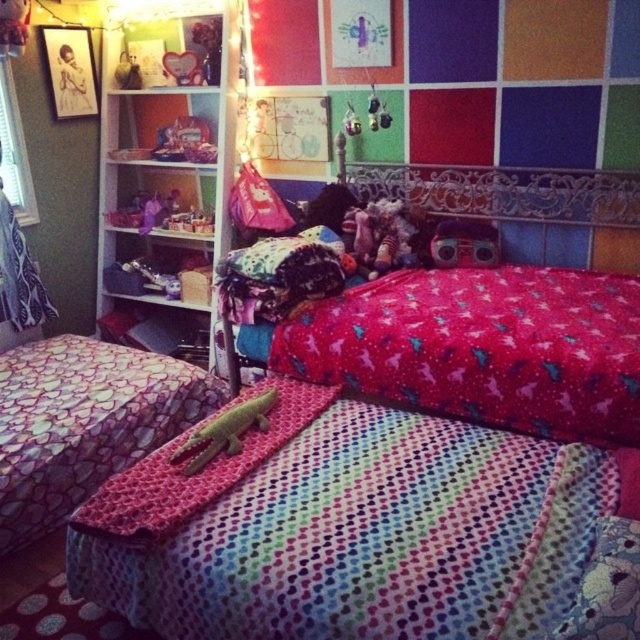
You are a parent trying to place a new nightstand in the bedroom. The nightstand is 1.2 meters tall. You see the red fabric bed at center and the matte plastic toy at center. Which object is taller and can the nightstand fit between them vertically?

The red fabric bed at center is much taller than the matte plastic toy at center. Since the nightstand is 1.2 meters tall, it can fit between them vertically as long as the space between their heights allows, but the exact placement depends on their specific height difference.

You are organizing a treasure hunt in the bedroom. The first clue is hidden on the red fabric bed at center, and the next clue is under the matte plastic toy at center. To reach the second clue from the first, which direction should you move?

To move from the red fabric bed at center to the matte plastic toy at center, you should move to the right since the red fabric bed at center is located to the left of the matte plastic toy at center.

You are standing in the bedroom and notice two points marked in the image. Which point, point (x=492, y=406) or point (x=467, y=243), is closer to you?

Point (x=492, y=406) is closer to the camera than point (x=467, y=243).